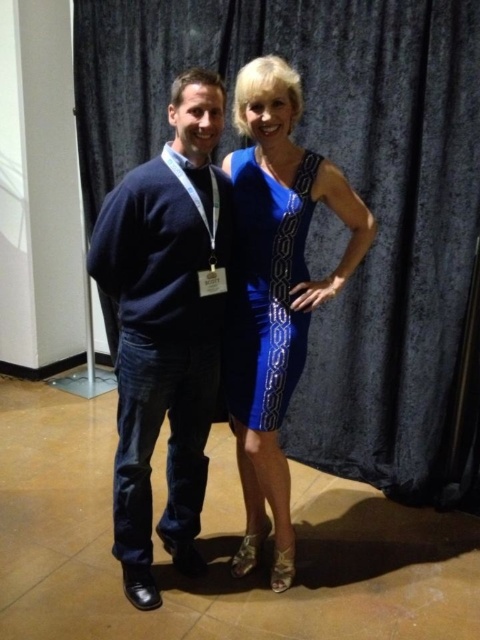
Does blue satin curtain at center have a larger size compared to blue satin dress at center?

Yes, blue satin curtain at center is bigger than blue satin dress at center.

Locate an element on the screen. Image resolution: width=480 pixels, height=640 pixels. blue satin curtain at center is located at coordinates (356, 189).

Where is `blue satin curtain at center`? blue satin curtain at center is located at coordinates (356, 189).

Where is `blue satin curtain at center`? blue satin curtain at center is located at coordinates [356, 189].

Which is above, blue satin curtain at center or dark blue sweater at left?

blue satin curtain at center is above.

Which of these two, blue satin curtain at center or dark blue sweater at left, stands taller?

Standing taller between the two is blue satin curtain at center.

Is point (421, 429) behind point (153, 579)?

Yes, point (421, 429) is behind point (153, 579).

This screenshot has width=480, height=640. Identify the location of blue satin curtain at center. (356, 189).

Between shiny blue dress at center and blue satin dress at center, which one is positioned lower?

shiny blue dress at center is below.

Who is positioned more to the left, shiny blue dress at center or blue satin dress at center?

From the viewer's perspective, blue satin dress at center appears more on the left side.

Between point (338, 205) and point (268, 273), which one is positioned in front?

Point (268, 273)

Image resolution: width=480 pixels, height=640 pixels. What are the coordinates of `shiny blue dress at center` in the screenshot? It's located at (276, 291).